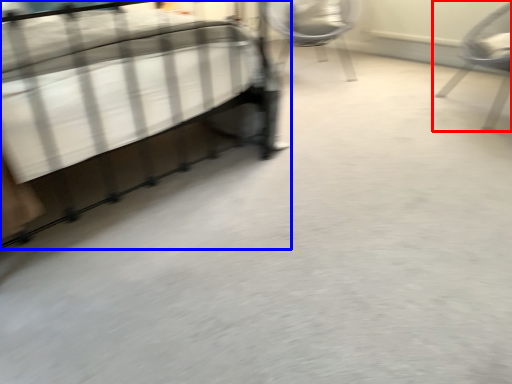
Question: Which of the following is the farthest to the observer, chair (highlighted by a red box) or bed (highlighted by a blue box)?

Choices:
 (A) chair
 (B) bed

Answer: (A)